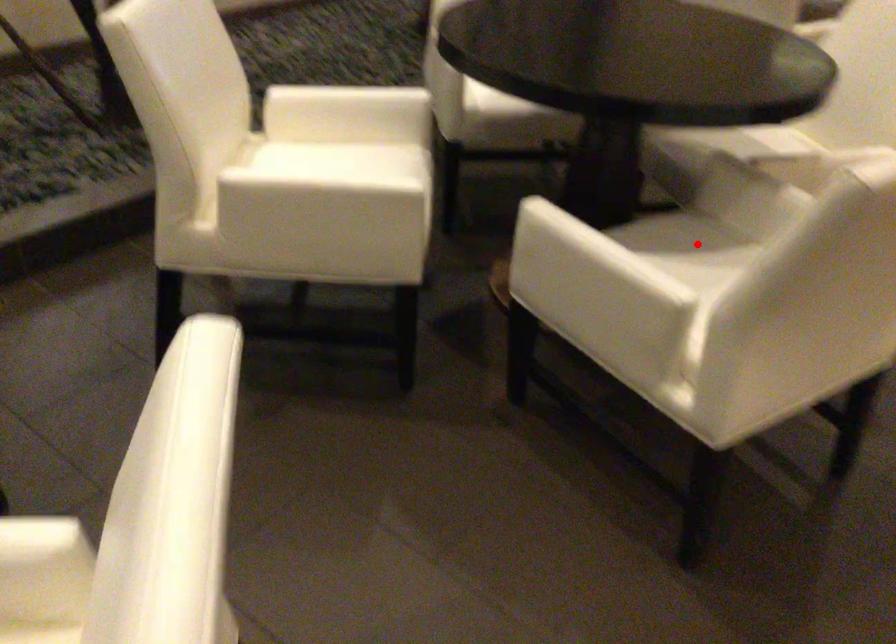
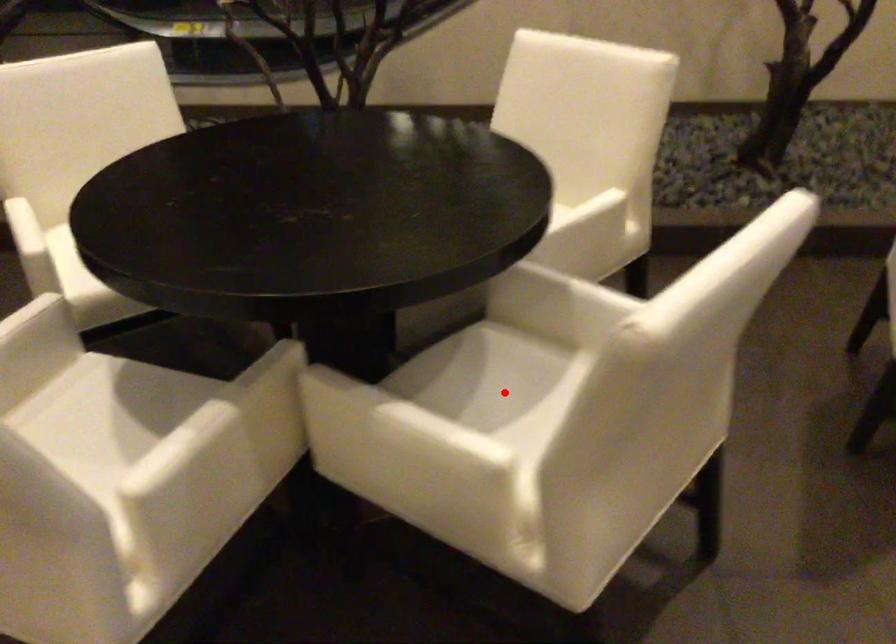
I am providing you with two images of the same scene from different viewpoints. A red point is marked on the first image and another point is marked on the second image. Are the points marked in image1 and image2 representing the same 3D position?

No